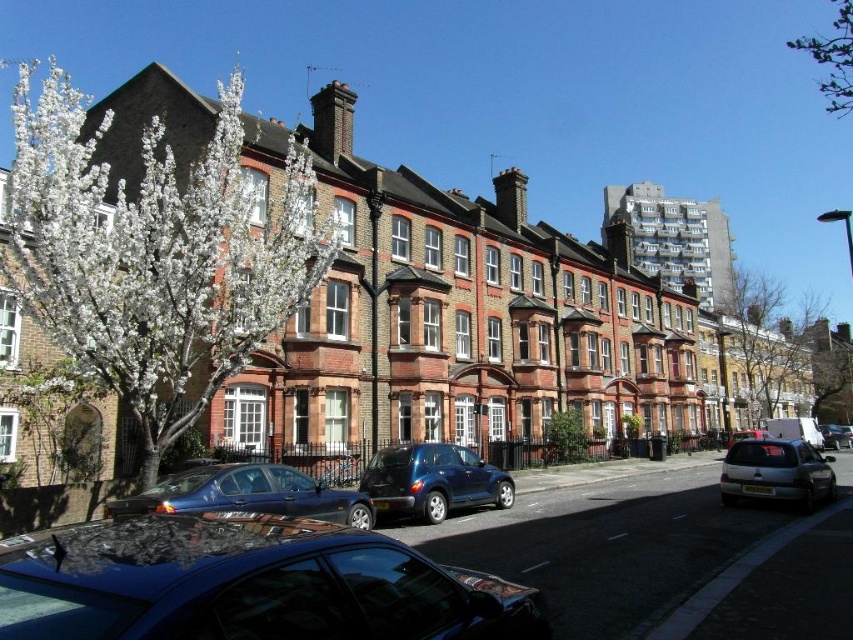
Looking at this image, who is more forward, (167, 628) or (785, 381)?

Positioned in front is point (167, 628).

Is glossy black car at lower center shorter than bare branches at upper center?

Correct, glossy black car at lower center is not as tall as bare branches at upper center.

Is point (381, 566) farther from camera compared to point (787, 374)?

No, (381, 566) is closer to viewer.

Where is `glossy black car at lower center`? The height and width of the screenshot is (640, 853). glossy black car at lower center is located at coordinates (248, 584).

Does glossy blue car at center appear on the right side of green leafy tree at upper right?

Incorrect, glossy blue car at center is not on the right side of green leafy tree at upper right.

Measure the distance between glossy blue car at center and green leafy tree at upper right.

A distance of 406.34 meters exists between glossy blue car at center and green leafy tree at upper right.

The height and width of the screenshot is (640, 853). What do you see at coordinates (432, 481) in the screenshot?
I see `glossy blue car at center` at bounding box center [432, 481].

Locate an element on the screen. glossy blue car at center is located at coordinates (432, 481).

From the picture: Between bare branches at upper center and metallic silver car at center, which one is positioned higher?

bare branches at upper center is above.

Locate an element on the screen. Image resolution: width=853 pixels, height=640 pixels. bare branches at upper center is located at coordinates (776, 352).

Does point (791, 336) lie behind point (746, 436)?

That is True.

This screenshot has width=853, height=640. Find the location of `bare branches at upper center`. bare branches at upper center is located at coordinates (776, 352).